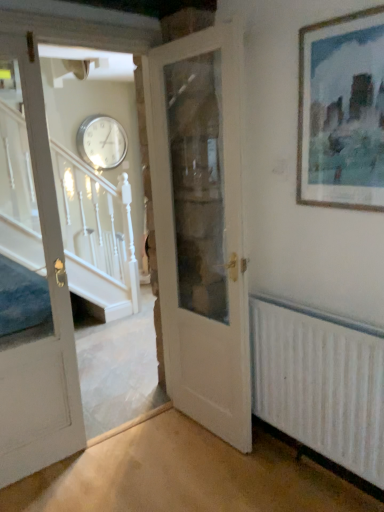
Question: From a real-world perspective, does white painted wood door at left, the first door viewed from the left, stand above white wooden door at center, placed as the 1th door when sorted from right to left?

Choices:
 (A) yes
 (B) no

Answer: (A)

Question: Is white painted wood door at left, the first door viewed from the left, shorter than white wooden door at center, placed as the 1th door when sorted from right to left?

Choices:
 (A) no
 (B) yes

Answer: (B)

Question: Is white painted wood door at left, the first door viewed from the left, positioned behind white wooden door at center, placed as the 1th door when sorted from right to left?

Choices:
 (A) no
 (B) yes

Answer: (A)

Question: Considering the relative sizes of white painted wood door at left, arranged as the 2th door when viewed from the right, and white wooden door at center, the 2th door from the left, in the image provided, is white painted wood door at left, arranged as the 2th door when viewed from the right, bigger than white wooden door at center, the 2th door from the left,?

Choices:
 (A) yes
 (B) no

Answer: (B)

Question: Are white painted wood door at left, arranged as the 2th door when viewed from the right, and white wooden door at center, the 2th door from the left, far apart?

Choices:
 (A) no
 (B) yes

Answer: (A)

Question: Would you say white wooden door at center, placed as the 1th door when sorted from right to left, is inside or outside white textured radiator at lower right?

Choices:
 (A) outside
 (B) inside

Answer: (A)

Question: Considering the positions of point (167, 97) and point (284, 393), is point (167, 97) closer or farther from the camera than point (284, 393)?

Choices:
 (A) closer
 (B) farther

Answer: (B)

Question: From a real-world perspective, is white wooden door at center, placed as the 1th door when sorted from right to left, above or below white textured radiator at lower right?

Choices:
 (A) below
 (B) above

Answer: (B)

Question: From the image's perspective, relative to white textured radiator at lower right, is white wooden door at center, the 2th door from the left, above or below?

Choices:
 (A) above
 (B) below

Answer: (A)

Question: Considering the positions of white painted wood door at left, the first door viewed from the left, and white wooden door at center, the 2th door from the left, in the image, is white painted wood door at left, the first door viewed from the left, bigger or smaller than white wooden door at center, the 2th door from the left,?

Choices:
 (A) big
 (B) small

Answer: (B)

Question: Is white painted wood door at left, the first door viewed from the left, wider or thinner than white wooden door at center, the 2th door from the left?

Choices:
 (A) wide
 (B) thin

Answer: (B)

Question: Is white painted wood door at left, arranged as the 2th door when viewed from the right, taller or shorter than white wooden door at center, the 2th door from the left?

Choices:
 (A) tall
 (B) short

Answer: (B)

Question: Does point (6, 312) appear closer or farther from the camera than point (221, 289)?

Choices:
 (A) closer
 (B) farther

Answer: (B)

Question: Considering the positions of white painted wood door at left, the first door viewed from the left, and wooden picture frame at upper right in the image, is white painted wood door at left, the first door viewed from the left, bigger or smaller than wooden picture frame at upper right?

Choices:
 (A) big
 (B) small

Answer: (A)

Question: In the image, is white painted wood door at left, the first door viewed from the left, positioned in front of or behind wooden picture frame at upper right?

Choices:
 (A) front
 (B) behind

Answer: (B)